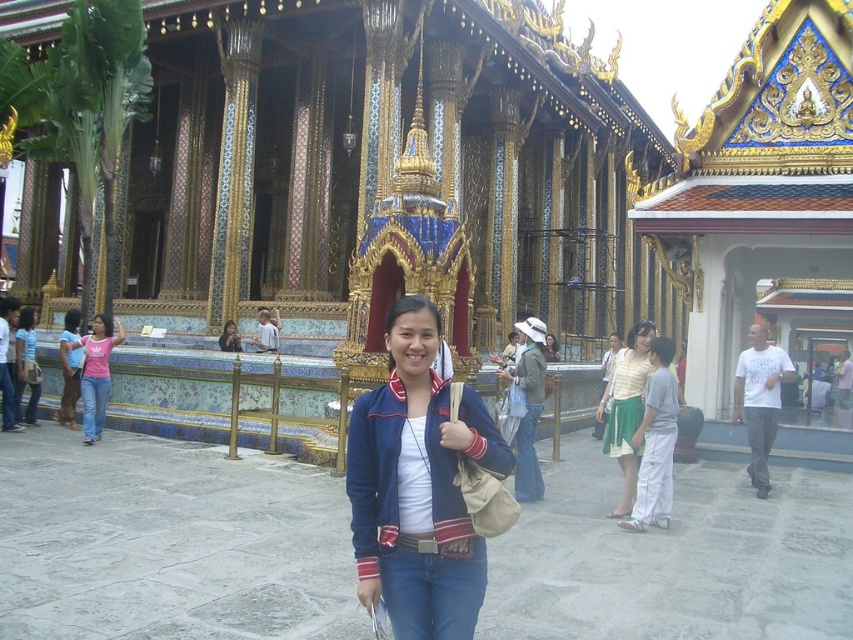
Question: Which object is positioned closest to the yellow-green cotton skirt at center-right?

Choices:
 (A) matte black jacket at center
 (B) pink cotton shirt at center
 (C) striped cotton dress at center

Answer: (C)

Question: Which object is positioned closest to the yellow-green cotton skirt at center-right?

Choices:
 (A) gold/gilded wood palace at center
 (B) matte black jacket at center
 (C) pink cotton shirt at center

Answer: (B)

Question: Considering the relative positions of gold/gilded wood palace at center and navy blue jacket at center in the image provided, where is gold/gilded wood palace at center located with respect to navy blue jacket at center?

Choices:
 (A) left
 (B) right

Answer: (B)

Question: Which of the following is the closest to the observer?

Choices:
 (A) gold/gilded wood palace at center
 (B) pink cotton shirt at center

Answer: (A)

Question: Observing the image, what is the correct spatial positioning of gold/gilded wood palace at center in reference to matte black jacket at center?

Choices:
 (A) above
 (B) below

Answer: (A)

Question: Can you confirm if gold/gilded wood palace at center is positioned below navy blue jacket at center?

Choices:
 (A) yes
 (B) no

Answer: (B)